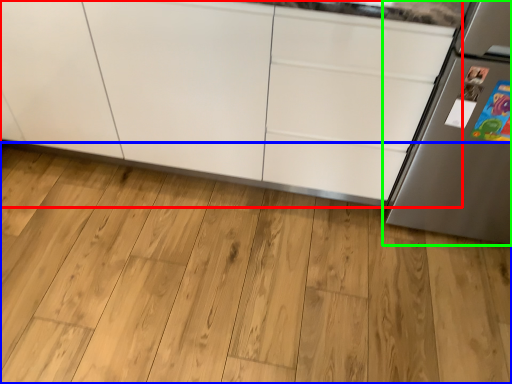
Question: Based on their relative distances, which object is nearer to cabinetry (highlighted by a red box)? Choose from hardwood (highlighted by a blue box) and refrigerator (highlighted by a green box).

Choices:
 (A) hardwood
 (B) refrigerator

Answer: (A)